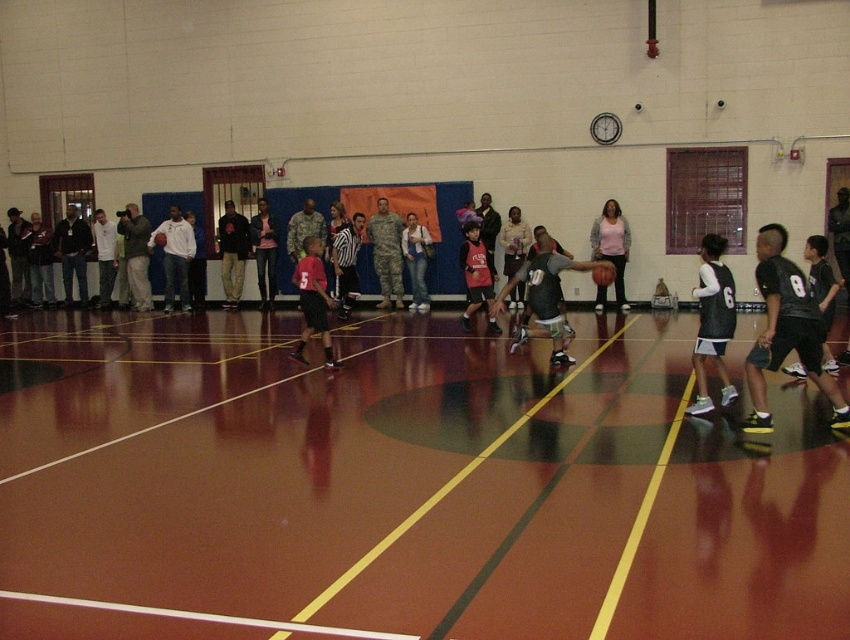
You are a spectator at the basketball game and want to take a photo of the denim jacket at center. Where should you aim your camera?

You should aim your camera at point (416,260) to capture the denim jacket at center.

You are a spectator at the basketball game and want to take a photo of both the matte pink sweater at center and the shiny orange basketball at center. Which object should you focus on first to ensure both are in the frame?

The matte pink sweater at center is larger than the shiny orange basketball at center, so you should focus on the matte pink sweater at center first to ensure both are in the frame.